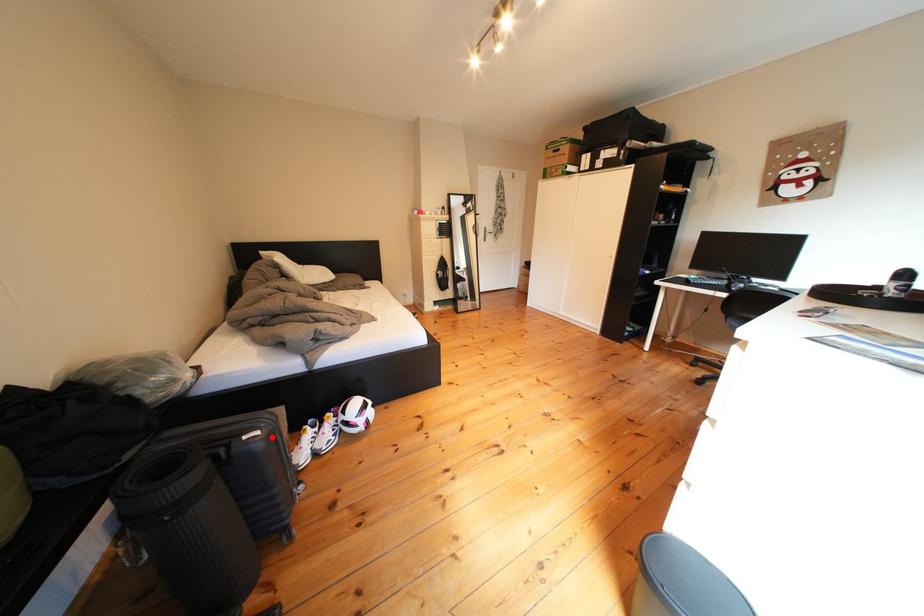
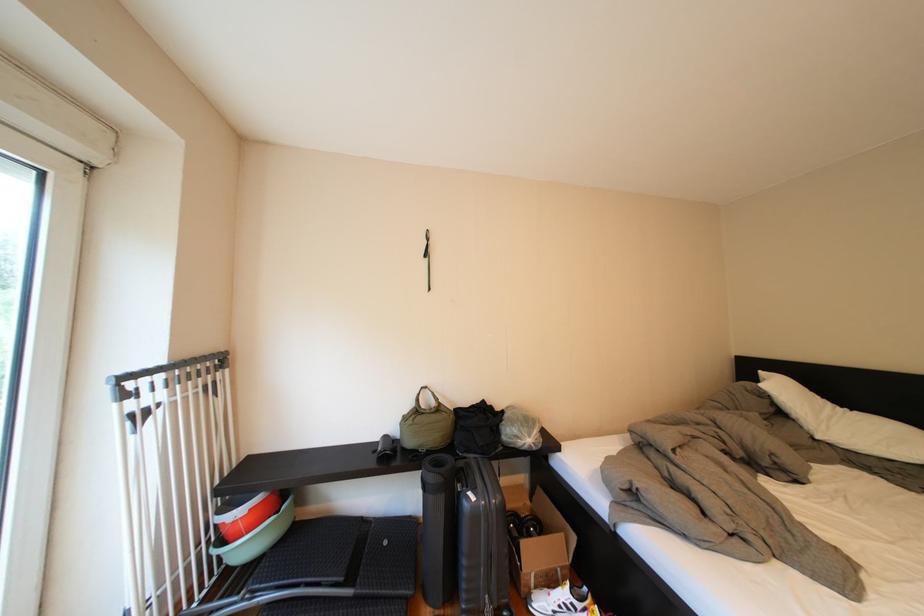
Question: I am providing you with two images of the same scene from different viewpoints. Given a red point in image1, look at the same physical point in image2. Is it:

Choices:
 (A) Closer to the viewpoint
 (B) Farther from the viewpoint

Answer: (B)